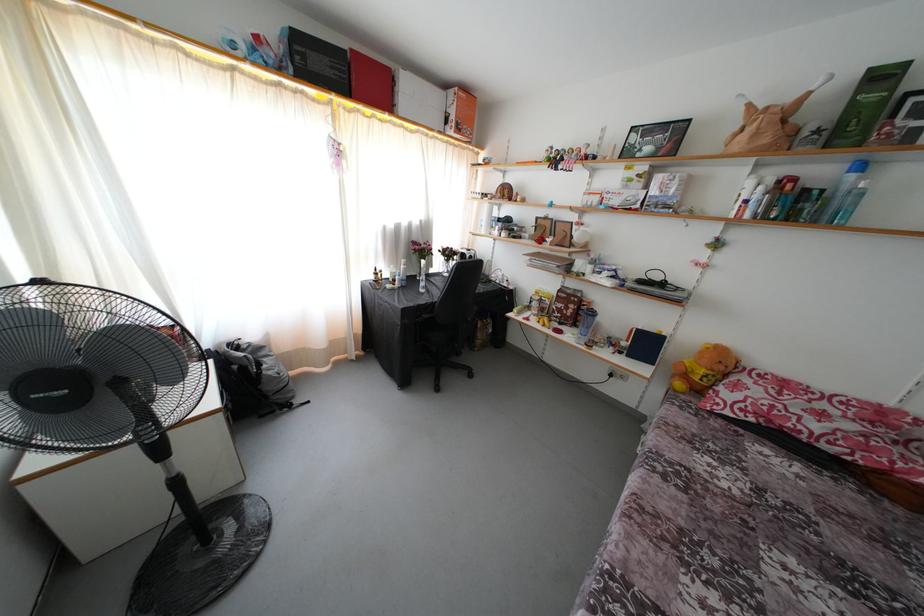
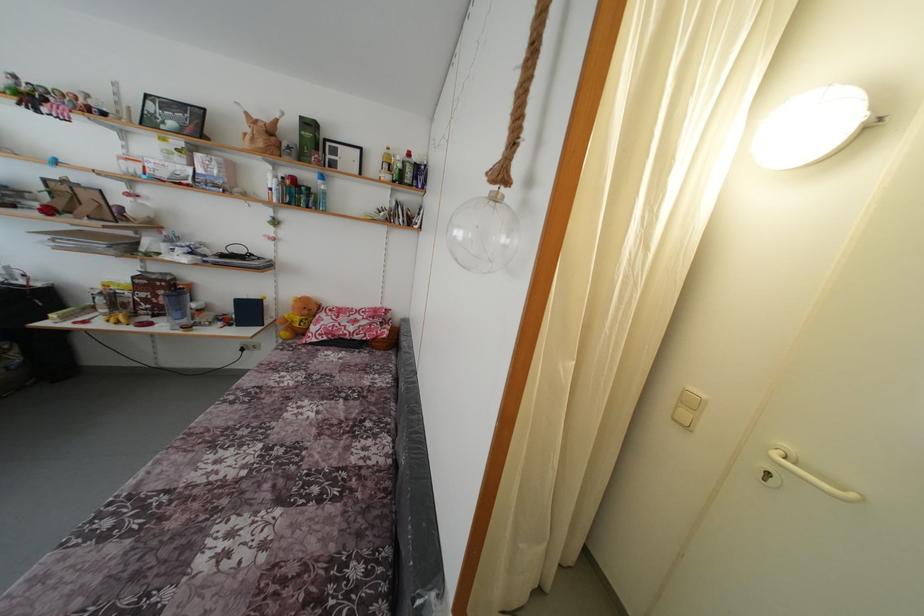
Find the pixel in the second image that matches (726,373) in the first image.

(310, 317)